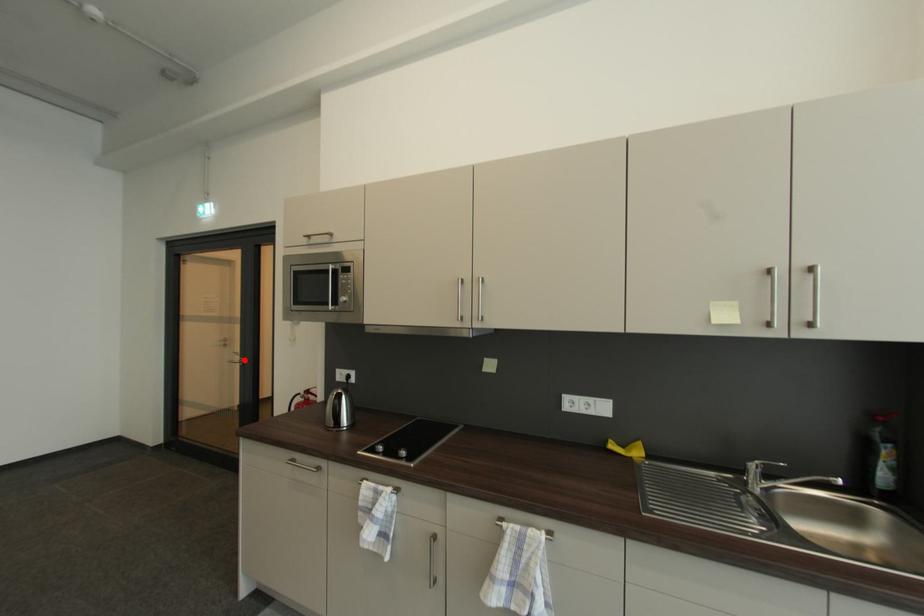
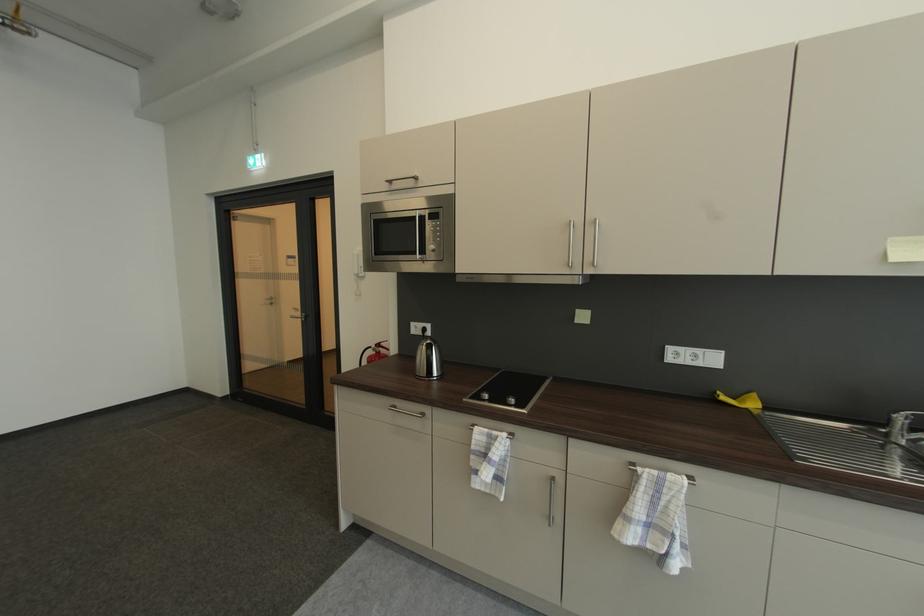
Locate, in the second image, the point that corresponds to the highlighted location in the first image.

(305, 315)